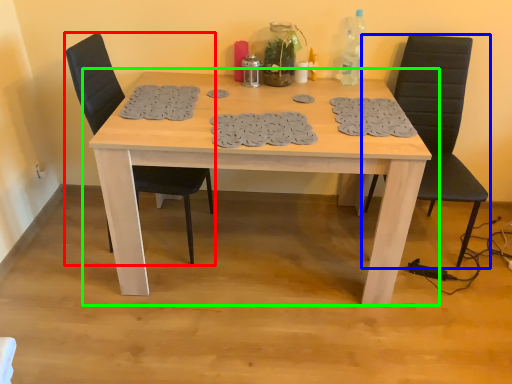
Question: Which object is positioned farthest from chair (highlighted by a red box)? Select from chair (highlighted by a blue box) and table (highlighted by a green box).

Choices:
 (A) chair
 (B) table

Answer: (A)